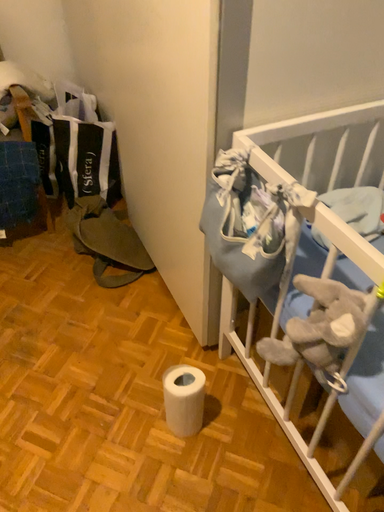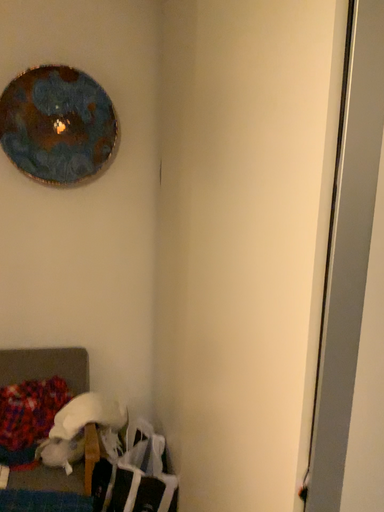
Question: Which way did the camera rotate in the video?

Choices:
 (A) rotated left
 (B) rotated right

Answer: (A)